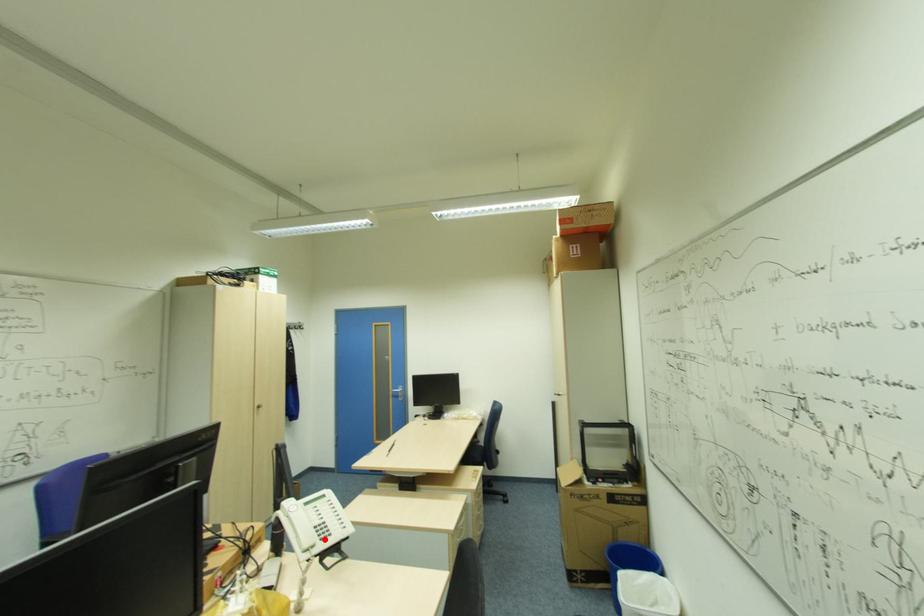
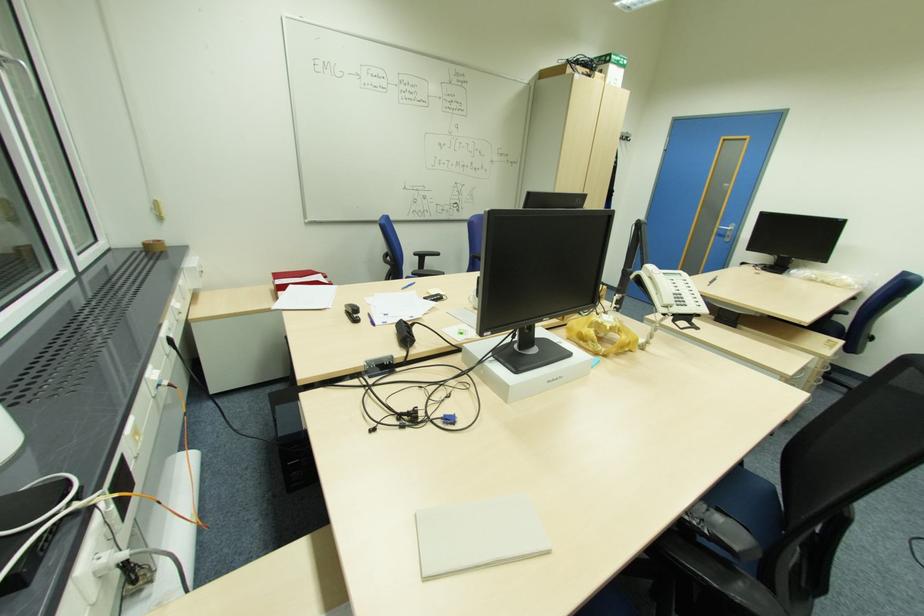
In the second image, find the point that corresponds to the highlighted location in the first image.

(681, 305)